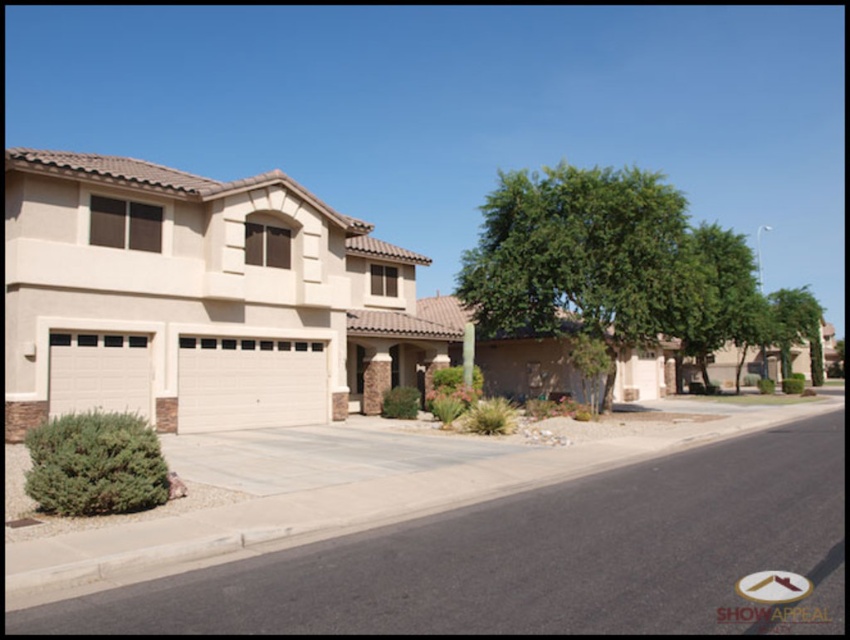
Question: Which object is the closest to the beige textured garage at center?

Choices:
 (A) white textured garage door at lower left
 (B) green leafy tree at upper right

Answer: (A)

Question: Which point is closer to the camera?

Choices:
 (A) green leafy tree at center
 (B) white textured garage door at lower left
 (C) green leafy tree at upper right

Answer: (B)

Question: Observing the image, what is the correct spatial positioning of beige textured garage at center in reference to green leafy tree at right?

Choices:
 (A) above
 (B) below

Answer: (B)

Question: In this image, where is beige textured garage door at center located relative to white textured garage door at lower left?

Choices:
 (A) below
 (B) above

Answer: (A)

Question: Which point is closer to the camera?

Choices:
 (A) green leafy tree at right
 (B) beige textured garage door at center

Answer: (B)

Question: Can you confirm if beige textured garage door at center is thinner than green leafy tree at right?

Choices:
 (A) no
 (B) yes

Answer: (B)